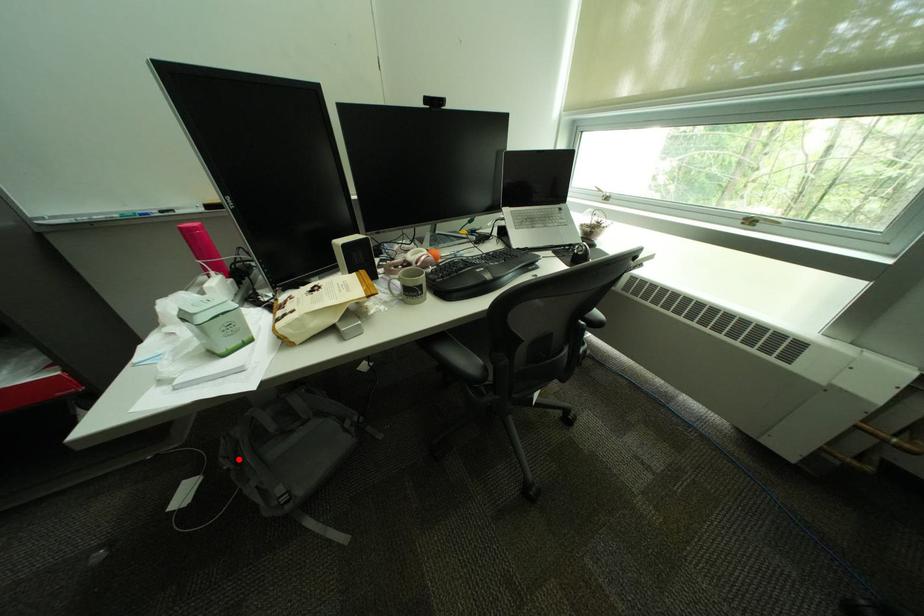
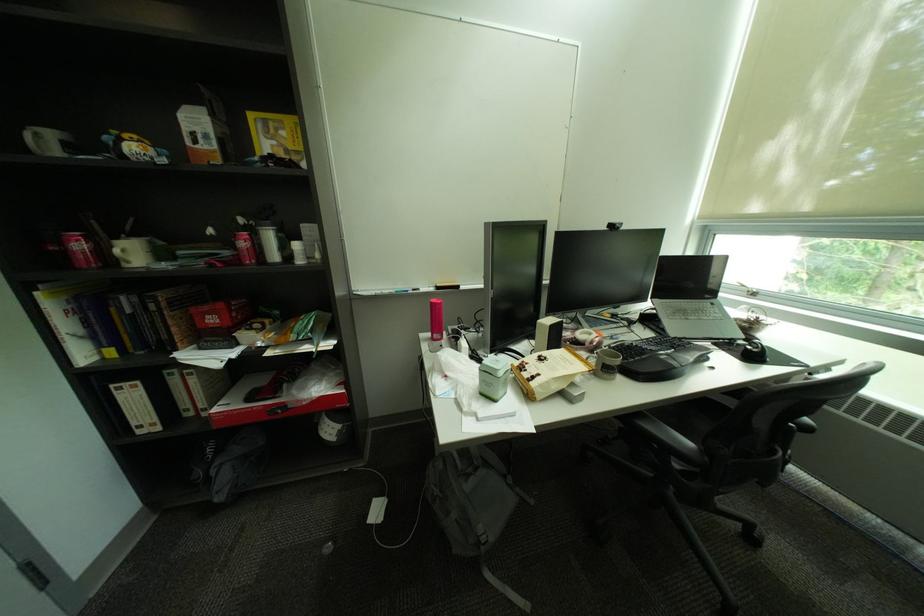
Find the pixel in the second image that matches the highlighted location in the first image.

(446, 487)